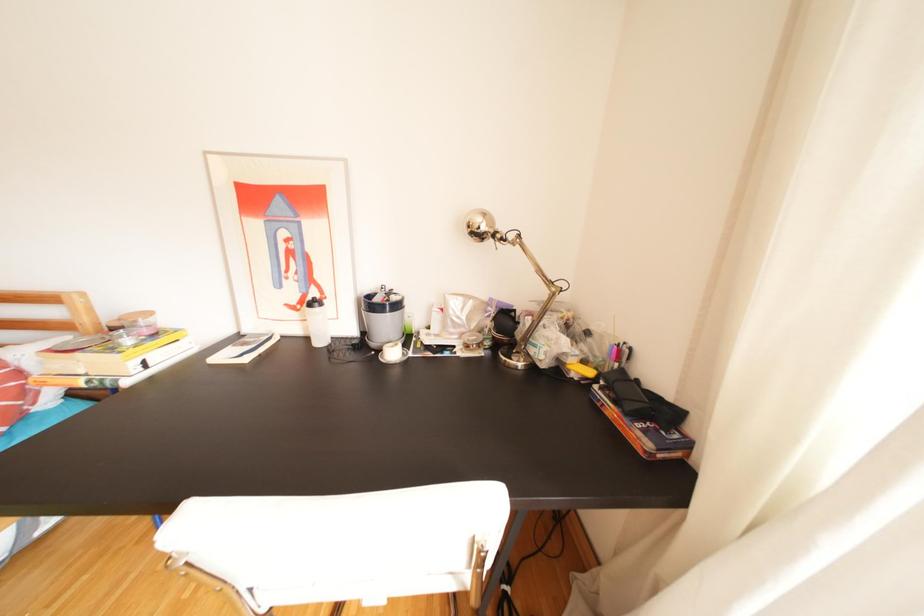
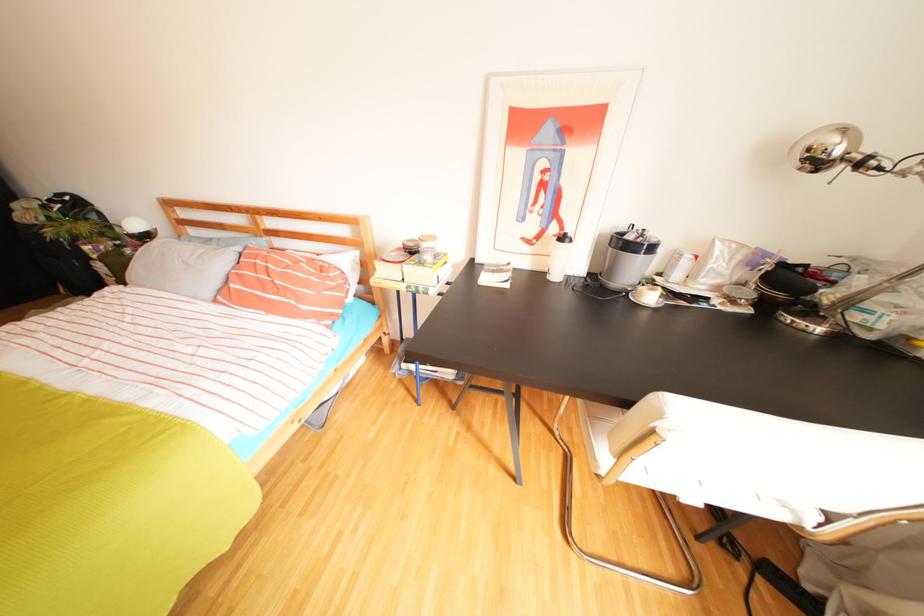
Question: How did the camera likely rotate?

Choices:
 (A) Left
 (B) Right
 (C) Up
 (D) Down

Answer: (A)